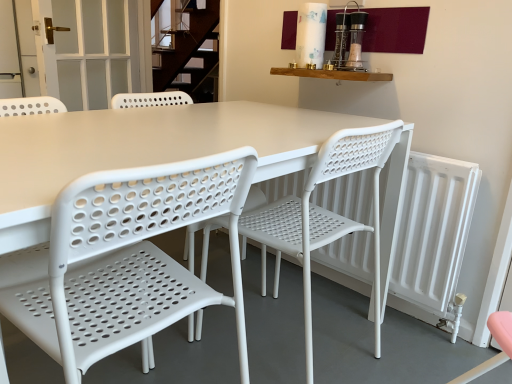
You are a GUI agent. You are given a task and a screenshot of the screen. Output one action in this format:
    pyautogui.click(x=<x>, y=<y>)
    Task: Click on the vacant area located to the right-hand side of white plastic chair at center, placed as the 1th chair when sorted from right to left
    
    Given the screenshot: What is the action you would take?
    pyautogui.click(x=398, y=347)